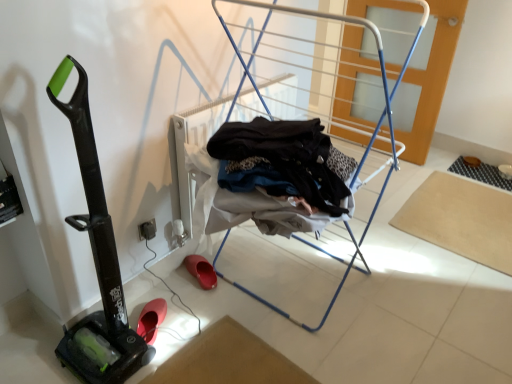
Identify the location of free space behind rubber/soft sole shoe at lower left, which appears as the second footwear when viewed from the back. (168, 289).